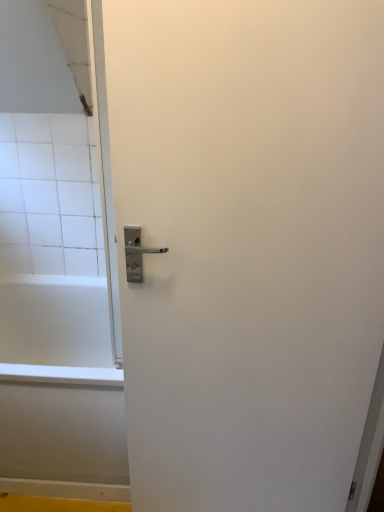
The image size is (384, 512). What are the coordinates of `white matte door handle at center` in the screenshot? It's located at (248, 245).

The width and height of the screenshot is (384, 512). What do you see at coordinates (248, 245) in the screenshot?
I see `white matte door handle at center` at bounding box center [248, 245].

Identify the location of white glossy bathtub at lower left. The width and height of the screenshot is (384, 512). (59, 382).

Describe the element at coordinates (59, 382) in the screenshot. The width and height of the screenshot is (384, 512). I see `white glossy bathtub at lower left` at that location.

The height and width of the screenshot is (512, 384). I want to click on white matte door handle at center, so click(248, 245).

Is white matte door handle at center to the left of white glossy bathtub at lower left from the viewer's perspective?

Incorrect, white matte door handle at center is not on the left side of white glossy bathtub at lower left.

Considering the positions of objects white matte door handle at center and white glossy bathtub at lower left in the image provided, who is behind, white matte door handle at center or white glossy bathtub at lower left?

white glossy bathtub at lower left is further from the camera.

Between point (123, 154) and point (14, 351), which one is positioned behind?

The point (14, 351) is behind.

From the image's perspective, would you say white matte door handle at center is positioned over white glossy bathtub at lower left?

Correct, white matte door handle at center appears higher than white glossy bathtub at lower left in the image.

From a real-world perspective, is white matte door handle at center above or below white glossy bathtub at lower left?

In terms of real-world spatial position, white matte door handle at center is above white glossy bathtub at lower left.

Considering the relative sizes of white matte door handle at center and white glossy bathtub at lower left in the image provided, is white matte door handle at center wider than white glossy bathtub at lower left?

No.

Does white matte door handle at center have a greater height compared to white glossy bathtub at lower left?

Yes, white matte door handle at center is taller than white glossy bathtub at lower left.

Is white matte door handle at center smaller than white glossy bathtub at lower left?

Correct, white matte door handle at center occupies less space than white glossy bathtub at lower left.

Would you say white matte door handle at center is outside white glossy bathtub at lower left?

Indeed, white matte door handle at center is completely outside white glossy bathtub at lower left.

Is white matte door handle at center far from white glossy bathtub at lower left?

No, there isn't a large distance between white matte door handle at center and white glossy bathtub at lower left.

Could you tell me if white matte door handle at center is facing white glossy bathtub at lower left?

No, white matte door handle at center is not oriented towards white glossy bathtub at lower left.

At what (x,y) coordinates should I click in order to perform the action: click on screen door in front of the white glossy bathtub at lower left. Please return your answer as a coordinate pair (x, y). Looking at the image, I should click on (248, 245).

Is white glossy bathtub at lower left to the right of white matte door handle at center from the viewer's perspective?

Incorrect, white glossy bathtub at lower left is not on the right side of white matte door handle at center.

Which object is more forward, white glossy bathtub at lower left or white matte door handle at center?

white matte door handle at center is in front.

Considering the positions of point (12, 418) and point (216, 24), is point (12, 418) closer or farther from the camera than point (216, 24)?

Clearly, point (12, 418) is more distant from the camera than point (216, 24).

From the image's perspective, is white glossy bathtub at lower left on white matte door handle at center?

Incorrect, from the image's perspective, white glossy bathtub at lower left is lower than white matte door handle at center.

From a real-world perspective, which object rests below the other?

white glossy bathtub at lower left is physically lower.

Between white glossy bathtub at lower left and white matte door handle at center, which one has smaller width?

With smaller width is white matte door handle at center.

Which of these two, white glossy bathtub at lower left or white matte door handle at center, stands shorter?

white glossy bathtub at lower left.

Considering the sizes of objects white glossy bathtub at lower left and white matte door handle at center in the image provided, who is smaller, white glossy bathtub at lower left or white matte door handle at center?

white matte door handle at center is smaller.

Is white glossy bathtub at lower left spatially inside white matte door handle at center, or outside of it?

white glossy bathtub at lower left exists outside the volume of white matte door handle at center.

Is white glossy bathtub at lower left directly adjacent to white matte door handle at center?

white glossy bathtub at lower left is not next to white matte door handle at center, and they're not touching.

Is white glossy bathtub at lower left facing towards white matte door handle at center?

No, white glossy bathtub at lower left is not turned towards white matte door handle at center.

How many degrees apart are the facing directions of white glossy bathtub at lower left and white matte door handle at center?

6.47 degrees.

At what (x,y) coordinates should I click in order to perform the action: click on bathtub below the white matte door handle at center (from the image's perspective). Please return your answer as a coordinate pair (x, y). Looking at the image, I should click on (59, 382).

Identify the location of bathtub that is behind the white matte door handle at center. The width and height of the screenshot is (384, 512). (59, 382).

You are a GUI agent. You are given a task and a screenshot of the screen. Output one action in this format:
    pyautogui.click(x=<x>, y=<y>)
    Task: Click on the screen door above the white glossy bathtub at lower left (from the image's perspective)
    The width and height of the screenshot is (384, 512).
    Given the screenshot: What is the action you would take?
    pyautogui.click(x=248, y=245)